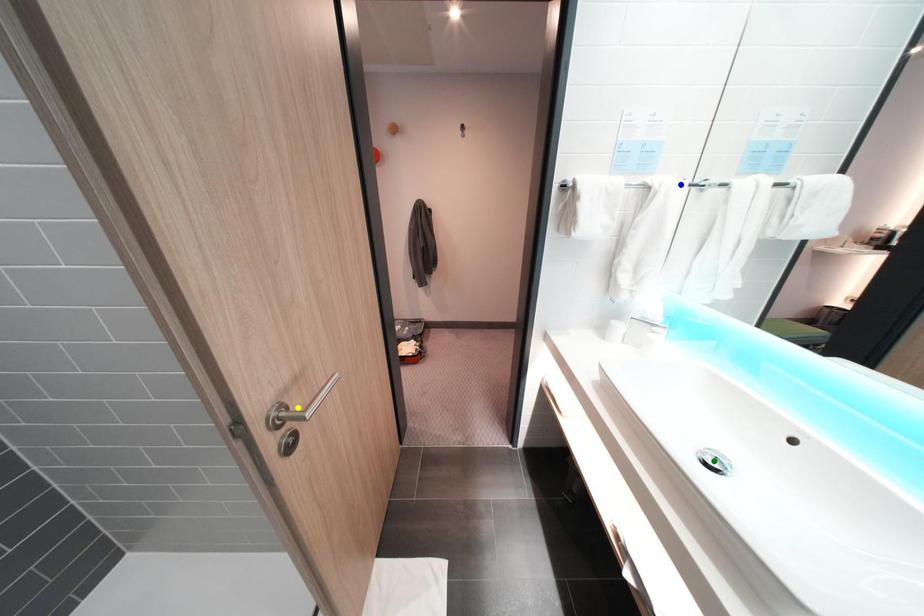
Order these from farthest to nearest:
1. yellow point
2. green point
3. blue point

blue point < green point < yellow point